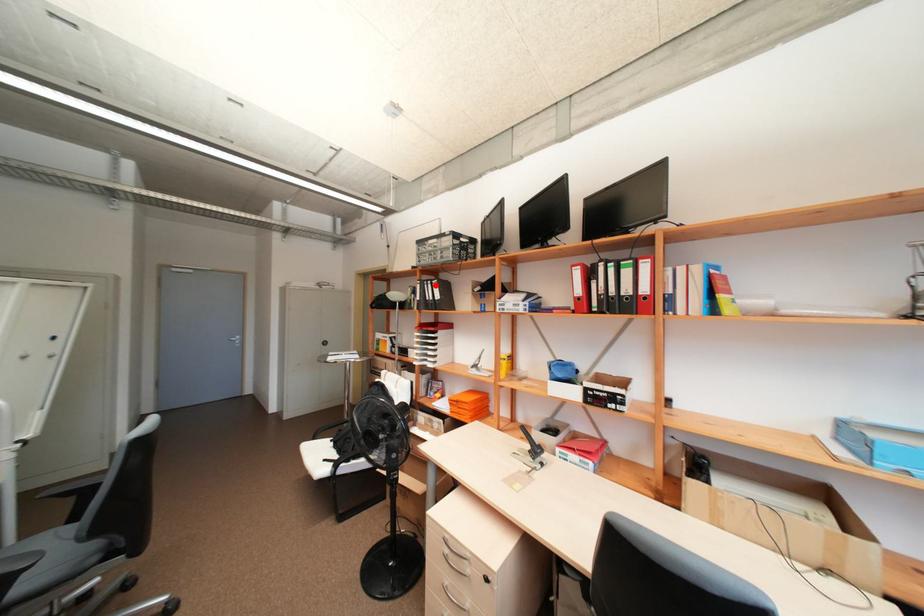
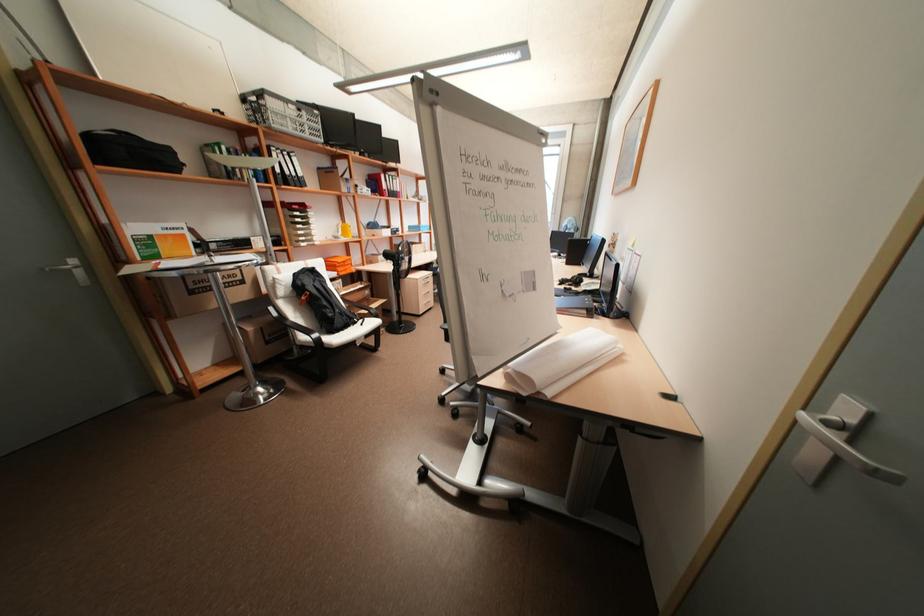
Find the pixel in the second image that matches the highlighted location in the first image.

(293, 158)